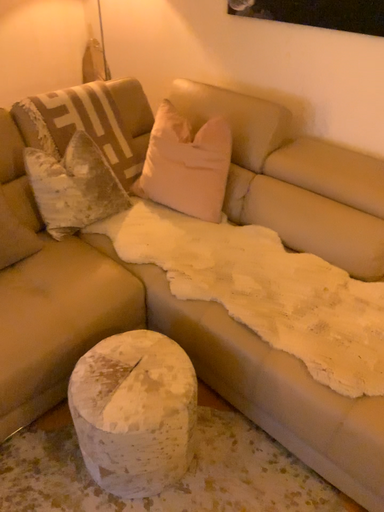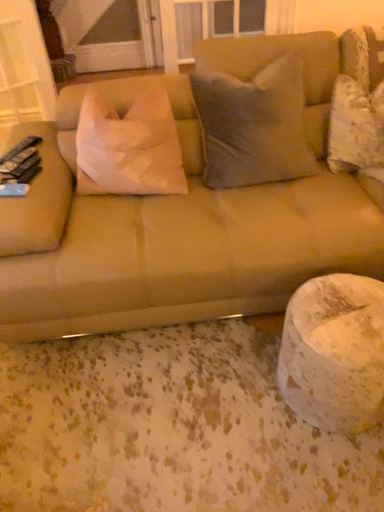
Question: Which way did the camera rotate in the video?

Choices:
 (A) rotated left
 (B) rotated right

Answer: (A)